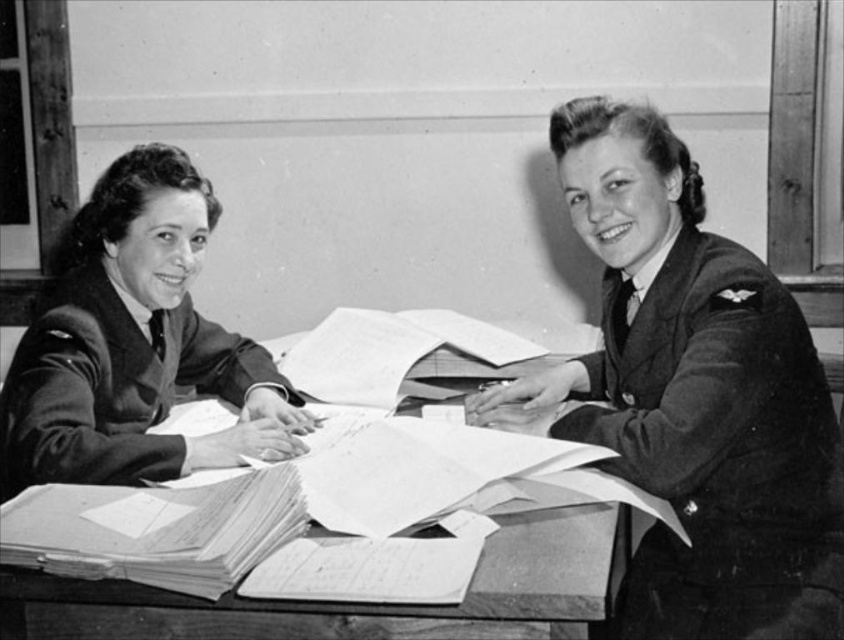
You are standing in front of the desk where the two women are sitting. You want to place a small object on the desk. The first point you consider is point (726, 252) and the second point is point (152, 600). Which point is closer to you?

Point (726, 252) is closer to you because it is further to the viewer than point (152, 600).

You are standing at the position of point (548, 545) and want to move to the position of point (279, 420). Can you walk directly forward without changing direction?

Point (279, 420) is behind point (548, 545), so you can walk directly forward without changing direction to reach it.